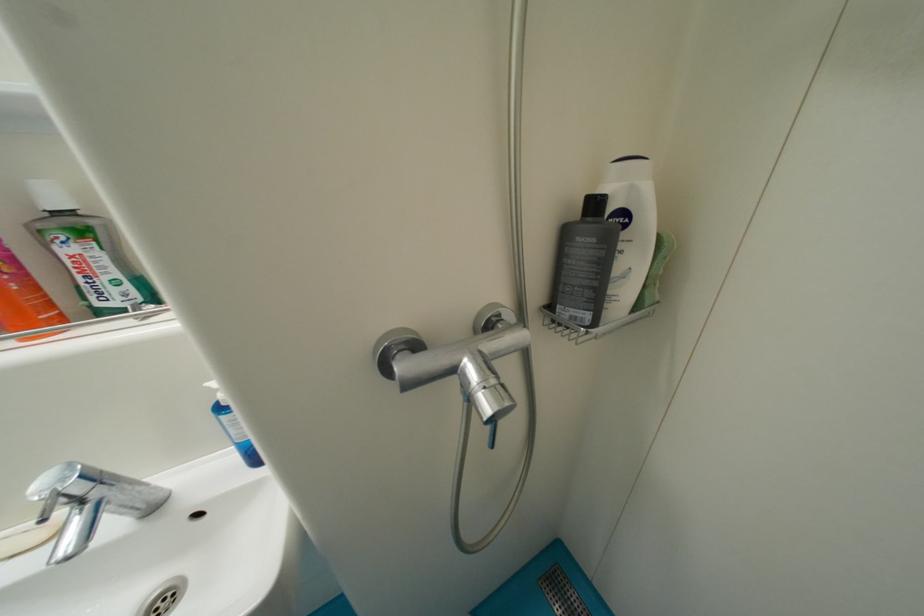
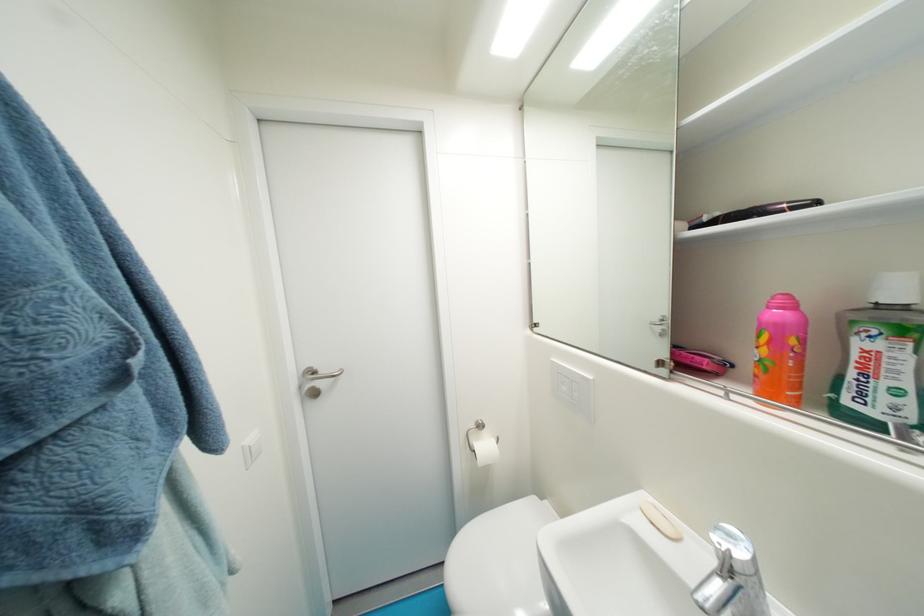
The point at [87,281] is marked in the first image. Where is the corresponding point in the second image?

(858, 376)